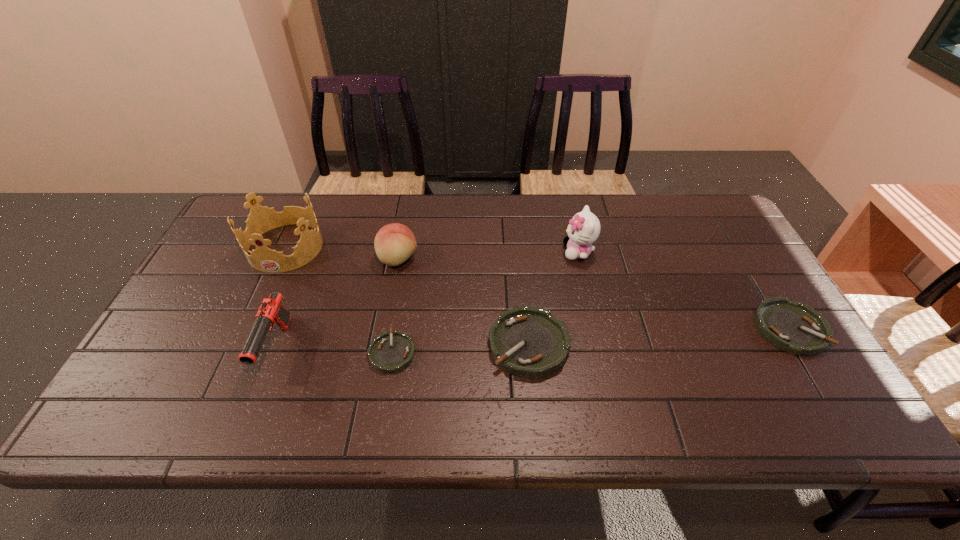
Please point a space for a new ashtray to maintain equal intervals. Please provide its 2D coordinates. Your answer should be formatted as a tuple, i.e. [(x, y)], where the tuple contains the x and y coordinates of a point satisfying the conditions above.

[(660, 336)]